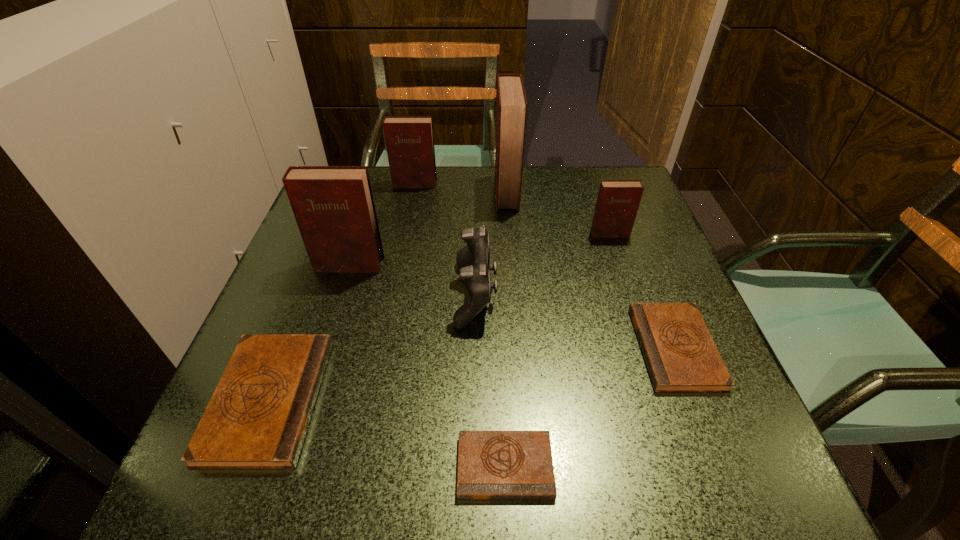
Identify the location of the sixth tallest object. The height and width of the screenshot is (540, 960). (257, 418).

Locate an element on the screen. This screenshot has width=960, height=540. the second smallest brown diary is located at coordinates (680, 354).

At what (x,y) coordinates should I click in order to perform the action: click on the rightmost brown diary. Please return your answer as a coordinate pair (x, y). Looking at the image, I should click on (680, 354).

The height and width of the screenshot is (540, 960). What are the coordinates of `the shortest diary` in the screenshot? It's located at (492, 465).

Where is `the smallest brown diary`? The width and height of the screenshot is (960, 540). the smallest brown diary is located at coordinates (492, 465).

I want to click on vacant space located 0.100m on the front cover of the third reddish-brown diary from left to right, so click(x=457, y=192).

Where is `free space located 0.100m on the front cover of the third reddish-brown diary from left to right`? The image size is (960, 540). free space located 0.100m on the front cover of the third reddish-brown diary from left to right is located at coordinates (457, 192).

You are a GUI agent. You are given a task and a screenshot of the screen. Output one action in this format:
    pyautogui.click(x=<x>, y=<y>)
    Task: Click on the vacant position located 0.400m on the front cover of the third reddish-brown diary from left to right
    Image resolution: width=960 pixels, height=540 pixels.
    Given the screenshot: What is the action you would take?
    pyautogui.click(x=342, y=192)

Image resolution: width=960 pixels, height=540 pixels. I want to click on vacant space located on the front cover of the sixth shortest diary, so click(x=339, y=296).

This screenshot has height=540, width=960. In order to click on free region located on the front cover of the third tallest object in this screenshot , I will do `click(406, 228)`.